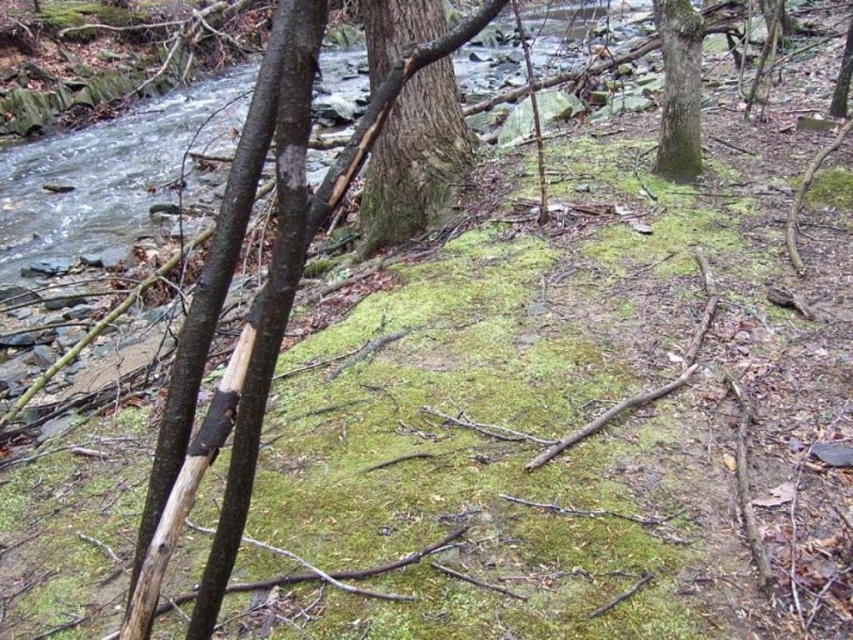
Question: Does green rough bark tree trunk at center have a smaller size compared to green rough bark tree trunk at upper right?

Choices:
 (A) no
 (B) yes

Answer: (A)

Question: Which object appears closest to the camera in this image?

Choices:
 (A) green rough bark tree trunk at upper right
 (B) green rough bark tree trunk at center

Answer: (B)

Question: Does green rough bark tree trunk at center appear under green rough bark tree trunk at upper right?

Choices:
 (A) yes
 (B) no

Answer: (A)

Question: Among these objects, which one is nearest to the camera?

Choices:
 (A) green rough bark tree trunk at center
 (B) green rough bark tree trunk at upper right

Answer: (A)

Question: Is green rough bark tree trunk at center behind green rough bark tree trunk at upper right?

Choices:
 (A) no
 (B) yes

Answer: (A)